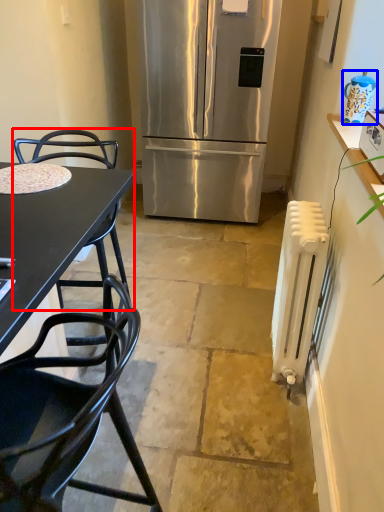
Question: Among these objects, which one is farthest to the camera, chair (highlighted by a red box) or appliance (highlighted by a blue box)?

Choices:
 (A) chair
 (B) appliance

Answer: (B)